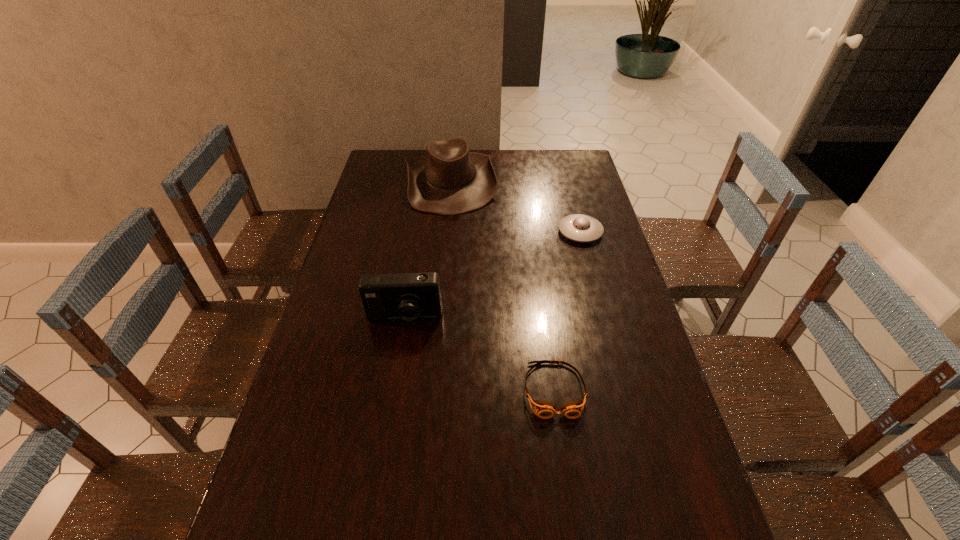
Locate an element on the screen. The image size is (960, 540). the farthest object is located at coordinates (449, 180).

I want to click on camera, so pos(404,296).

The height and width of the screenshot is (540, 960). I want to click on the third nearest object, so click(x=581, y=228).

You are a GUI agent. You are given a task and a screenshot of the screen. Output one action in this format:
    pyautogui.click(x=<x>, y=<y>)
    Task: Click on the rightmost object
    
    Given the screenshot: What is the action you would take?
    pyautogui.click(x=581, y=228)

The image size is (960, 540). In order to click on the third object from left to right in this screenshot , I will do `click(543, 409)`.

The width and height of the screenshot is (960, 540). I want to click on goggles, so click(543, 409).

Locate an element on the screen. This screenshot has width=960, height=540. vacant area located on the right of the farthest object is located at coordinates pyautogui.click(x=554, y=181).

Find the location of a particular element. This screenshot has width=960, height=540. vacant space located 0.400m on the front-facing side of the camera is located at coordinates (378, 478).

This screenshot has height=540, width=960. Identify the location of free location located 0.380m on the back of the rightmost object. [x=563, y=165].

You are a GUI agent. You are given a task and a screenshot of the screen. Output one action in this format:
    pyautogui.click(x=<x>, y=<y>)
    Task: Click on the free region located with the lenses facing forward on the second object from right to left
    
    Given the screenshot: What is the action you would take?
    pyautogui.click(x=563, y=449)